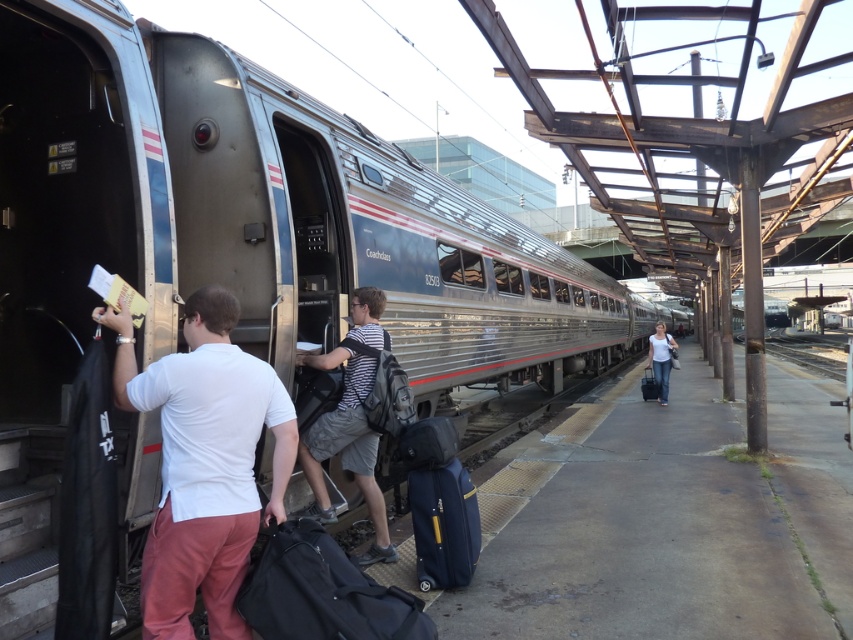
Between striped cotton shirt at center and blue fabric suitcase at lower center, which one is positioned higher?

Positioned higher is striped cotton shirt at center.

Between striped cotton shirt at center and blue fabric suitcase at lower center, which one appears on the left side from the viewer's perspective?

striped cotton shirt at center

Who is more forward, (323, 360) or (430, 554)?

Positioned in front is point (430, 554).

Where is `striped cotton shirt at center`? striped cotton shirt at center is located at coordinates (350, 422).

Who is taller, white cotton shirt at center or matte black suitcase at right?

With more height is white cotton shirt at center.

Based on the photo, is white cotton shirt at center bigger than matte black suitcase at right?

Indeed, white cotton shirt at center has a larger size compared to matte black suitcase at right.

This screenshot has height=640, width=853. Find the location of `white cotton shirt at center`. white cotton shirt at center is located at coordinates (660, 358).

Which of these two, white matte shirt at left or striped cotton shirt at center, stands shorter?

Standing shorter between the two is white matte shirt at left.

Is white matte shirt at left below striped cotton shirt at center?

No, white matte shirt at left is not below striped cotton shirt at center.

Does point (190, 376) come in front of point (328, 438)?

Yes, it is in front of point (328, 438).

Find the location of `white matte shirt at left`. white matte shirt at left is located at coordinates (204, 464).